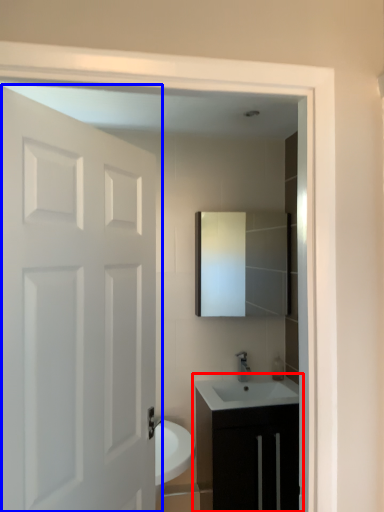
Question: Among these objects, which one is nearest to the camera, bathroom cabinet (highlighted by a red box) or door (highlighted by a blue box)?

Choices:
 (A) bathroom cabinet
 (B) door

Answer: (B)